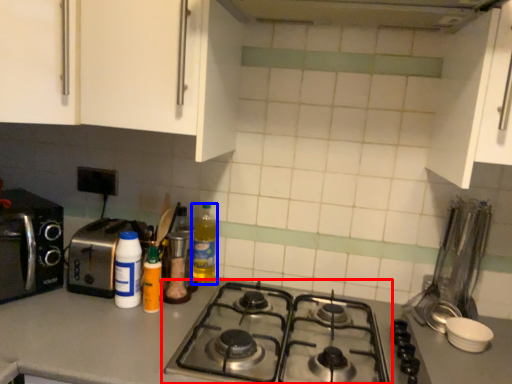
Question: Which point is further to the camera, gas stove (highlighted by a red box) or bottle (highlighted by a blue box)?

Choices:
 (A) gas stove
 (B) bottle

Answer: (B)